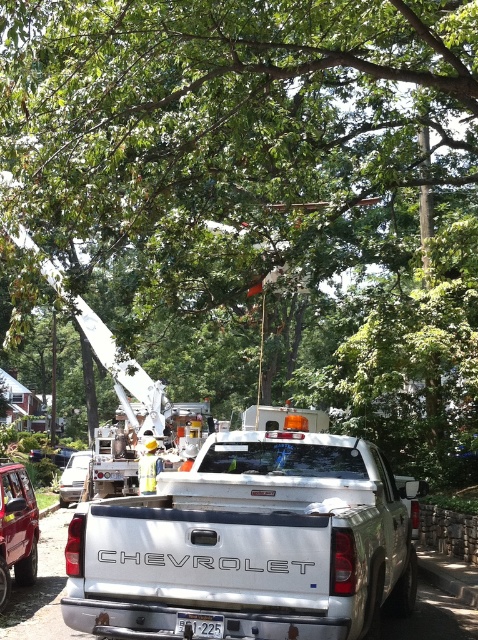
How distant is white metallic truck at center from white plastic license plate at center?

white metallic truck at center is 4.47 feet from white plastic license plate at center.

Between white metallic truck at center and white plastic license plate at center, which one appears on the left side from the viewer's perspective?

white plastic license plate at center is more to the left.

What do you see at coordinates (249, 544) in the screenshot?
I see `white metallic truck at center` at bounding box center [249, 544].

This screenshot has width=478, height=640. What are the coordinates of `white metallic truck at center` in the screenshot? It's located at (249, 544).

Is metallic silver van at center taller than white plastic license plate at center?

Yes.

Does metallic silver van at center appear on the right side of white plastic license plate at center?

No, metallic silver van at center is not to the right of white plastic license plate at center.

Where is `metallic silver van at center`? This screenshot has width=478, height=640. metallic silver van at center is located at coordinates (74, 477).

Between point (318, 508) and point (63, 477), which one is positioned behind?

The point (63, 477) is behind.

Is point (216, 528) in front of point (76, 480)?

Yes, it is.

Locate an element on the screen. This screenshot has height=640, width=478. white metallic truck at center is located at coordinates (249, 544).